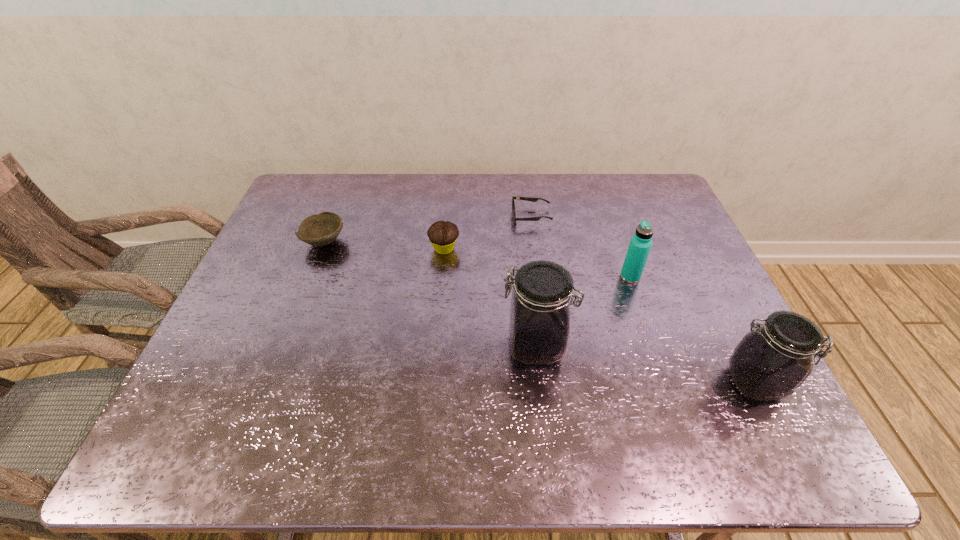
Please show where to add a jar on the left while keeping spacing even. Please provide its 2D coordinates. Your answer should be formatted as a tuple, i.e. [(x, y)], where the tuple contains the x and y coordinates of a point satisfying the conditions above.

[(342, 314)]